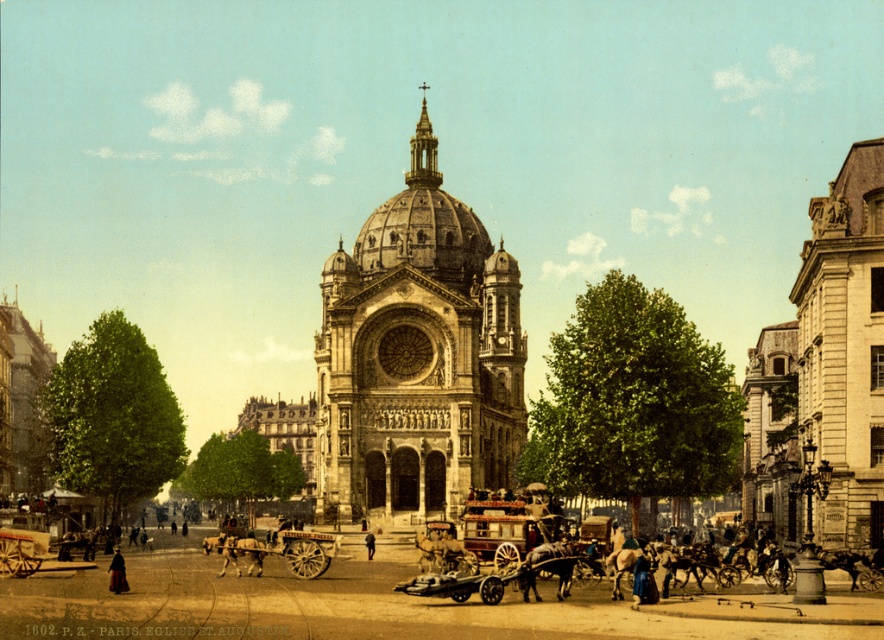
You are a visitor standing at the entrance of the cathedral and see the wooden cart at lower left and the brown leather coat at center. Which object is positioned more to the left side of the scene?

The wooden cart at lower left is positioned more to the left side of the scene than the brown leather coat at center.

You are standing in front of the cathedral and want to take a photo of both the stone building at right and the wooden polished cart at center. Which object should you focus on first to ensure both are in frame?

You should focus on the stone building at right first because it is closer to the viewer than the wooden polished cart at center, so adjusting the camera to include both would require starting with the closer object.